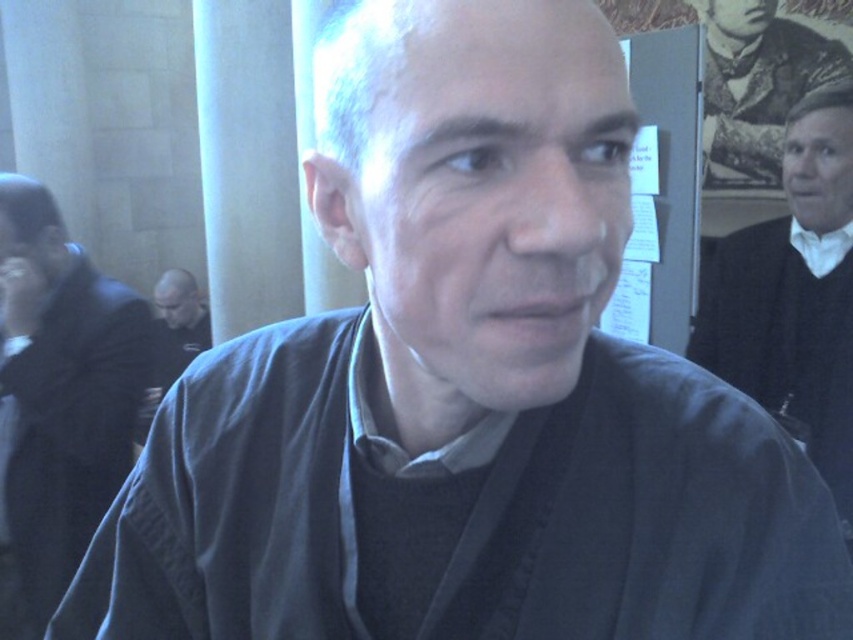
Question: Does dark blue fabric at center appear on the right side of dark gray sweater at right?

Choices:
 (A) yes
 (B) no

Answer: (B)

Question: Which point appears closest to the camera in this image?

Choices:
 (A) (186, 362)
 (B) (195, 388)
 (C) (801, 253)
 (D) (35, 612)

Answer: (B)

Question: Is dark gray sweater at center smaller than white cotton shirt at upper right?

Choices:
 (A) no
 (B) yes

Answer: (A)

Question: Which object appears closest to the camera in this image?

Choices:
 (A) dark gray sweater at center
 (B) dark blue fabric at center
 (C) white cotton shirt at upper right

Answer: (B)

Question: Is dark gray fabric at center to the left of dark gray sweater at center from the viewer's perspective?

Choices:
 (A) yes
 (B) no

Answer: (B)

Question: Which of the following is the closest to the observer?

Choices:
 (A) dark gray sweater at center
 (B) dark gray fabric at center
 (C) dark blue fabric at center
 (D) dark gray sweater at right

Answer: (C)